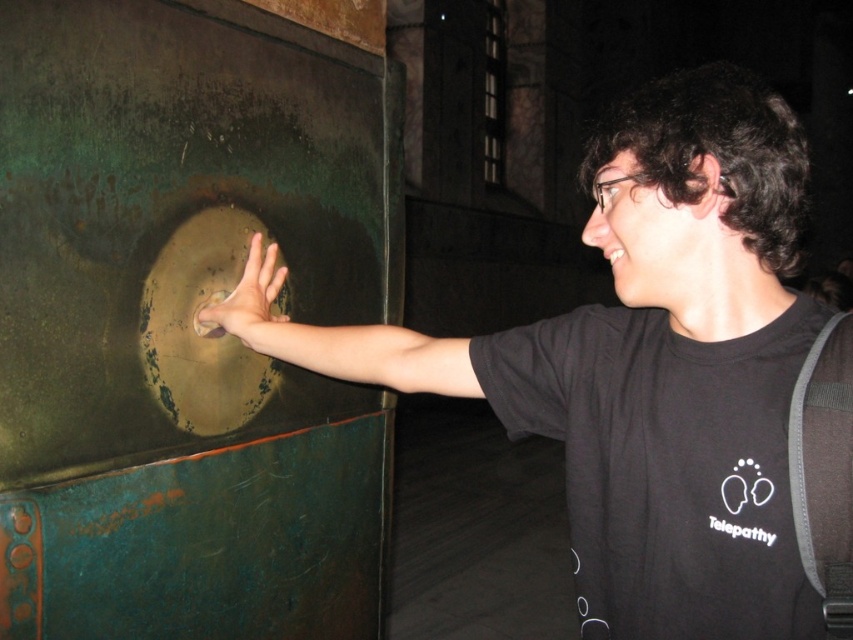
Question: Which of the following is the farthest from the observer?

Choices:
 (A) (585, 362)
 (B) (285, 317)

Answer: (B)

Question: Is matte green door handle at center-left positioned in front of smooth bronze hand at center?

Choices:
 (A) yes
 (B) no

Answer: (A)

Question: Which of the following is the farthest from the observer?

Choices:
 (A) (543, 429)
 (B) (264, 289)

Answer: (B)

Question: Does matte green door handle at center-left appear on the left side of smooth bronze hand at center?

Choices:
 (A) yes
 (B) no

Answer: (B)

Question: Does matte green door handle at center-left have a lesser width compared to smooth bronze hand at center?

Choices:
 (A) yes
 (B) no

Answer: (B)